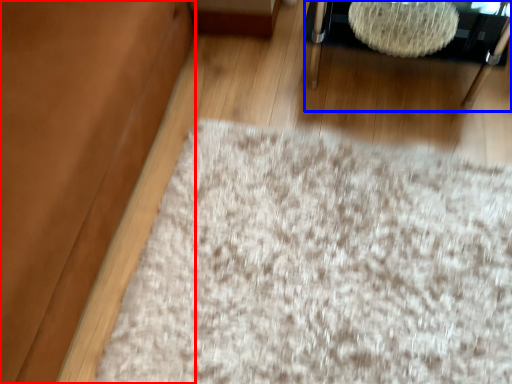
Question: Which of the following is the closest to the observer, couch (highlighted by a red box) or furniture (highlighted by a blue box)?

Choices:
 (A) couch
 (B) furniture

Answer: (A)